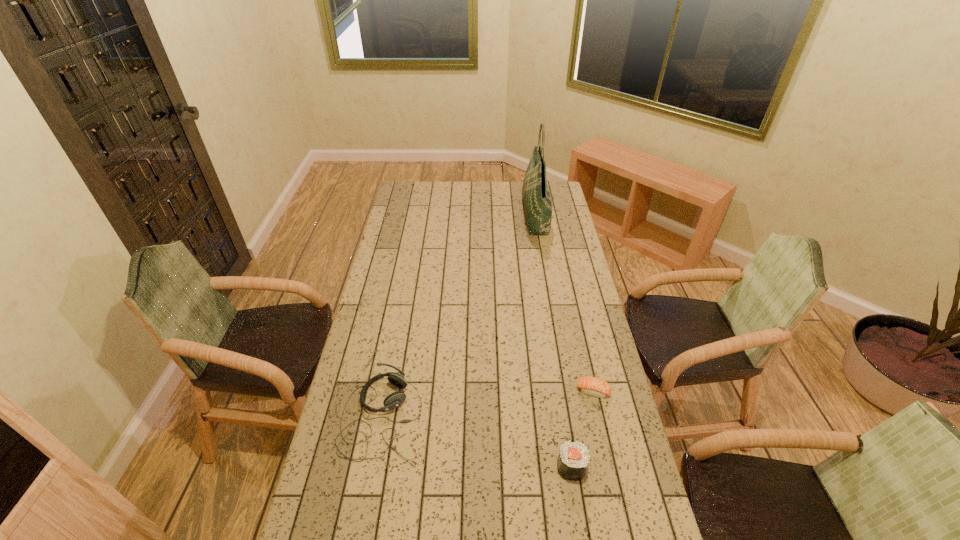
Identify which object is the nearest to the shorter sushi. Please provide its 2D coordinates. Your answer should be formatted as a tuple, i.e. [(x, y)], where the tuple contains the x and y coordinates of a point satisfying the conditions above.

[(573, 459)]

I want to click on free spot that satisfies the following two spatial constraints: 1. on the outer surface of the leftmost object; 2. on the right side of the taller sushi, so click(x=374, y=467).

At what (x,y) coordinates should I click in order to perform the action: click on blank space that satisfies the following two spatial constraints: 1. on the back side of the nearer sushi; 2. on the right side of the tote bag. Please return your answer as a coordinate pair (x, y). The width and height of the screenshot is (960, 540). Looking at the image, I should click on (532, 216).

You are a GUI agent. You are given a task and a screenshot of the screen. Output one action in this format:
    pyautogui.click(x=<x>, y=<y>)
    Task: Click on the blank area in the image that satisfies the following two spatial constraints: 1. on the outer surface of the left sushi; 2. on the left side of the leftmost object
    Image resolution: width=960 pixels, height=540 pixels.
    Given the screenshot: What is the action you would take?
    pyautogui.click(x=374, y=467)

Locate an element on the screen. blank area in the image that satisfies the following two spatial constraints: 1. on the outer surface of the leftmost object; 2. on the left side of the nearer sushi is located at coordinates (374, 467).

Identify the location of free location that satisfies the following two spatial constraints: 1. on the front side of the right sushi; 2. on the outer surface of the headset. (599, 418).